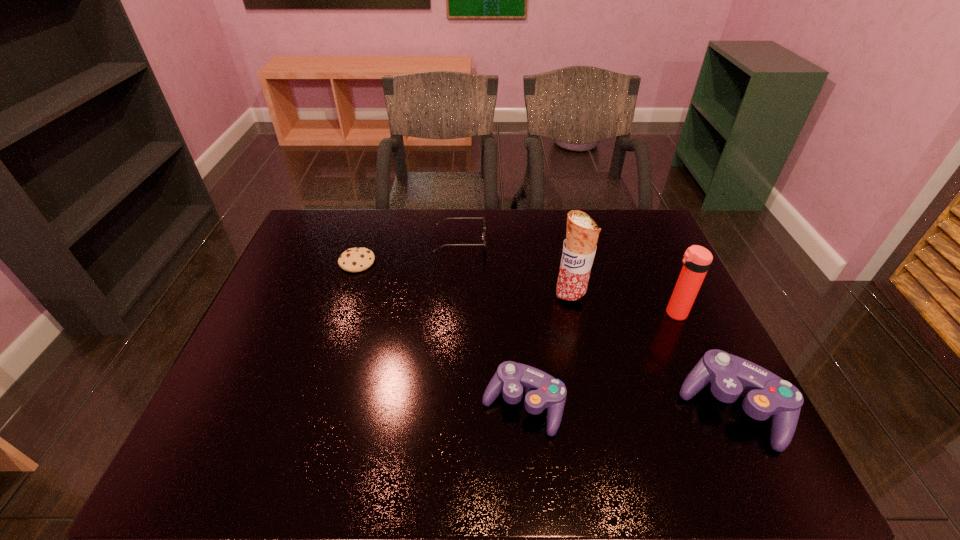
The width and height of the screenshot is (960, 540). What are the coordinates of `vacant space in between the thermos bottle and the fourth tallest object` in the screenshot? It's located at (599, 359).

You are a GUI agent. You are given a task and a screenshot of the screen. Output one action in this format:
    pyautogui.click(x=<x>, y=<y>)
    Task: Click on the free space between the third tallest object and the left control
    The image size is (960, 540).
    Given the screenshot: What is the action you would take?
    pyautogui.click(x=627, y=407)

Identify the location of unoccupied position between the cookie and the spectacles. (409, 252).

In order to click on vacant area that lies between the third tallest object and the shortest object in this screenshot , I will do `click(544, 335)`.

This screenshot has width=960, height=540. Identify the location of object that stands as the fifth closest to the second shortest object. (765, 394).

You are a GUI agent. You are given a task and a screenshot of the screen. Output one action in this format:
    pyautogui.click(x=<x>, y=<y>)
    Task: Click on the object that is the fourth closest one to the thermos bottle
    
    Given the screenshot: What is the action you would take?
    pyautogui.click(x=483, y=234)

Locate an element on the screen. vacant space that satisfies the following two spatial constraints: 1. through the lenses of the left control; 2. on the right side of the fifth tallest object is located at coordinates (452, 405).

I want to click on vacant point that satisfies the following two spatial constraints: 1. through the lenses of the spectacles; 2. on the back side of the thermos bottle, so click(x=457, y=313).

This screenshot has height=540, width=960. What are the coordinates of `vacant point that satisfies the following two spatial constraints: 1. on the front side of the third tallest object; 2. on the right side of the thermos bottle` in the screenshot? It's located at (717, 408).

Find the location of a particular element. vacant position in the image that satisfies the following two spatial constraints: 1. on the front side of the right control; 2. on the right side of the second tallest object is located at coordinates (717, 408).